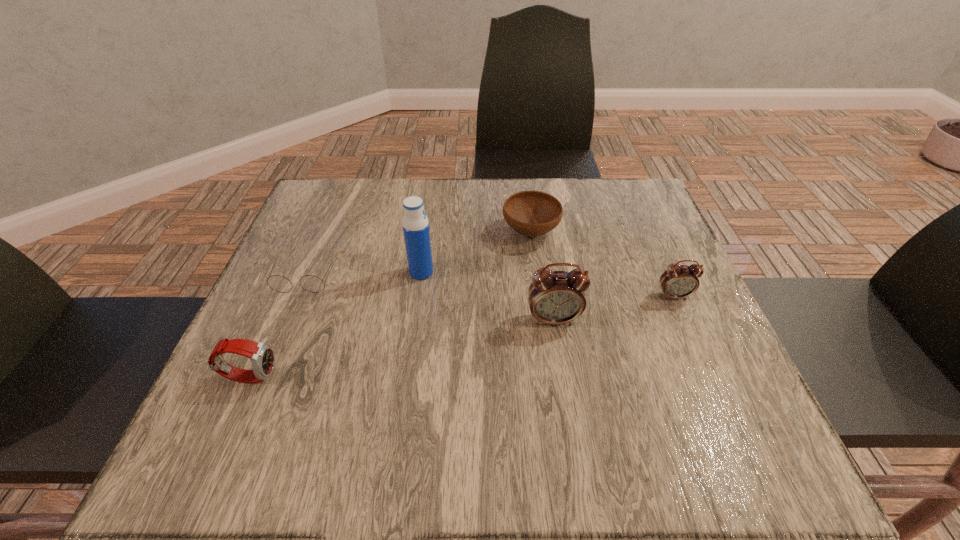
Identify the location of free space located 0.100m on the face of the fifth farthest object. The width and height of the screenshot is (960, 540). (562, 373).

Find the location of a particular element. This screenshot has width=960, height=540. vacant space located on the face of the farther alarm clock is located at coordinates (718, 397).

Where is `free region located 0.060m on the temples of the spectacles`? This screenshot has width=960, height=540. free region located 0.060m on the temples of the spectacles is located at coordinates (290, 316).

Where is `vacant position located on the front of the farthest object`? This screenshot has height=540, width=960. vacant position located on the front of the farthest object is located at coordinates (540, 302).

This screenshot has height=540, width=960. I want to click on vacant area located on the face of the watch, so click(328, 376).

Locate an element on the screen. Image resolution: width=960 pixels, height=540 pixels. free location located 0.180m on the back of the water bottle is located at coordinates (429, 216).

Image resolution: width=960 pixels, height=540 pixels. I want to click on object present at the far edge, so click(531, 213).

Locate an element on the screen. The height and width of the screenshot is (540, 960). object situated at the near edge is located at coordinates (262, 357).

Find the location of a particular element. The width and height of the screenshot is (960, 540). spectacles situated at the left edge is located at coordinates (278, 283).

Identify the location of watch that is at the left edge. (262, 357).